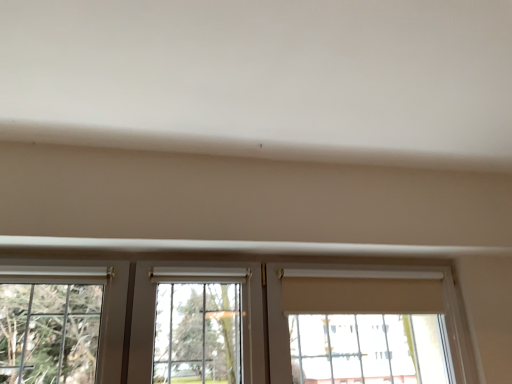
Identify the location of white plastic window at center. (245, 322).

The image size is (512, 384). What do you see at coordinates (245, 322) in the screenshot? I see `white plastic window at center` at bounding box center [245, 322].

Locate an element on the screen. Image resolution: width=512 pixels, height=384 pixels. white plastic window at center is located at coordinates coord(245,322).